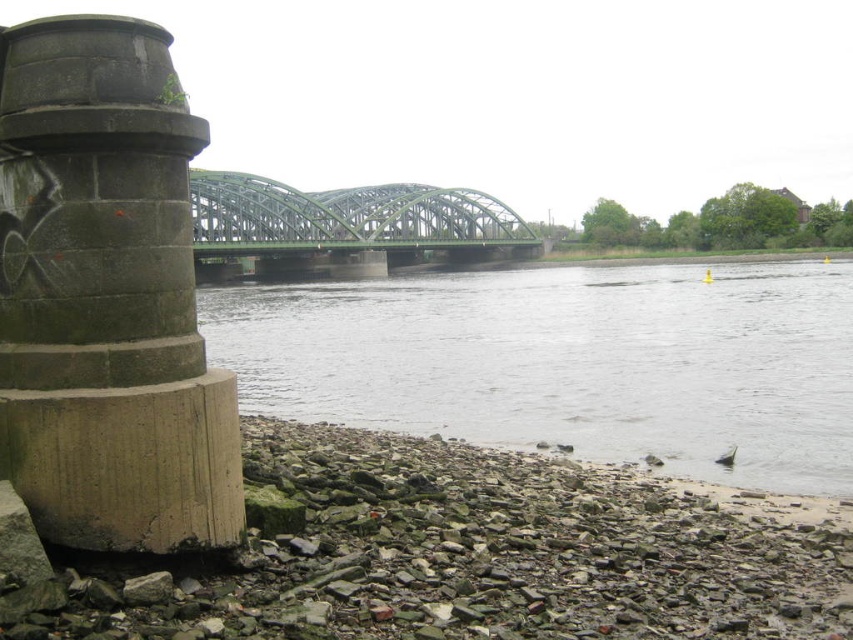
Is rough stone river bank at lower left smaller than gray gravel river at lower center?

Indeed, rough stone river bank at lower left has a smaller size compared to gray gravel river at lower center.

Is point (509, 529) closer to viewer compared to point (496, 385)?

Yes, it is in front of point (496, 385).

Which is in front, point (251, 625) or point (387, 278)?

Positioned in front is point (251, 625).

At what (x,y) coordinates should I click in order to perform the action: click on rough stone river bank at lower left. Please return your answer as a coordinate pair (x, y). The image size is (853, 640). Looking at the image, I should click on (463, 554).

Can you confirm if gray gravel river at lower center is thinner than green metallic bridge at center?

No.

Does gray gravel river at lower center have a greater height compared to green metallic bridge at center?

Incorrect, gray gravel river at lower center's height is not larger of green metallic bridge at center's.

At what (x,y) coordinates should I click in order to perform the action: click on gray gravel river at lower center. Please return your answer as a coordinate pair (x, y). This screenshot has width=853, height=640. Looking at the image, I should click on (567, 362).

Locate an element on the screen. The height and width of the screenshot is (640, 853). gray gravel river at lower center is located at coordinates (567, 362).

Which of these two, rough stone river bank at lower left or concrete pillar at left, stands taller?

concrete pillar at left

Is point (547, 618) less distant than point (30, 115)?

No, (547, 618) is behind (30, 115).

Find the location of `rough stone river bank at lower left`. rough stone river bank at lower left is located at coordinates (463, 554).